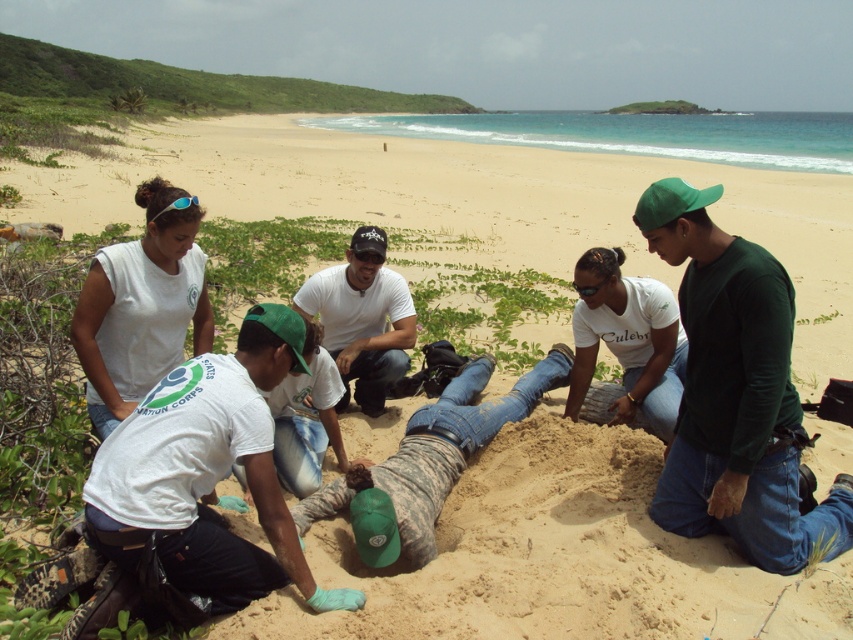
Does white cotton shirt at lower left come in front of white matte shirt at center?

Yes, white cotton shirt at lower left is in front of white matte shirt at center.

Consider the image. Measure the distance between point (270, 372) and camera.

3.30 meters

The width and height of the screenshot is (853, 640). Find the location of `white cotton shirt at lower left`. white cotton shirt at lower left is located at coordinates (207, 474).

Looking at this image, does green matte shirt at center have a smaller size compared to white cotton shirt at lower left?

Incorrect, green matte shirt at center is not smaller in size than white cotton shirt at lower left.

Does green matte shirt at center have a lesser height compared to white cotton shirt at lower left?

No, green matte shirt at center is not shorter than white cotton shirt at lower left.

Where is `green matte shirt at center`? This screenshot has height=640, width=853. green matte shirt at center is located at coordinates [735, 394].

Can you confirm if green matte shirt at center is shorter than white matte shirt at center?

No.

Based on the photo, is green matte shirt at center above white matte shirt at center?

No, green matte shirt at center is not above white matte shirt at center.

This screenshot has height=640, width=853. Identify the location of green matte shirt at center. (735, 394).